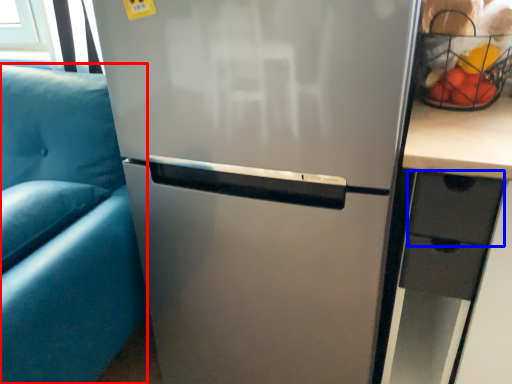
Question: Among these objects, which one is farthest to the camera, armchair (highlighted by a red box) or drawer (highlighted by a blue box)?

Choices:
 (A) armchair
 (B) drawer

Answer: (B)